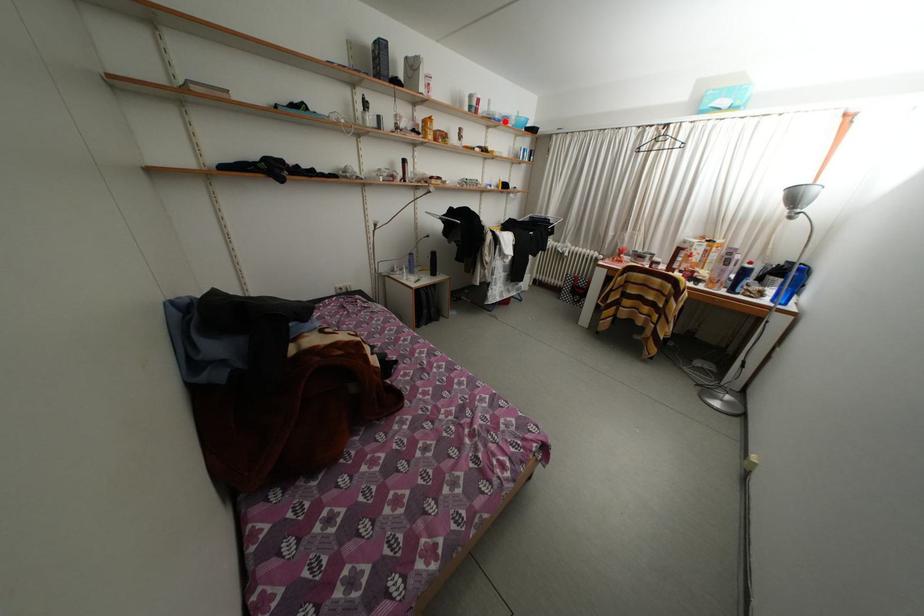
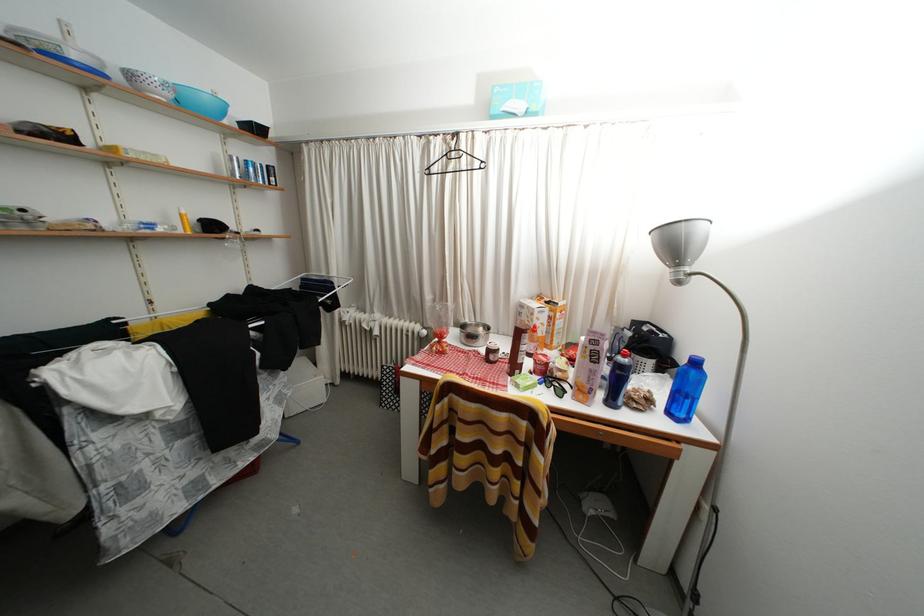
Find the pixel in the second image that matches the highlighted location in the first image.

(81, 61)